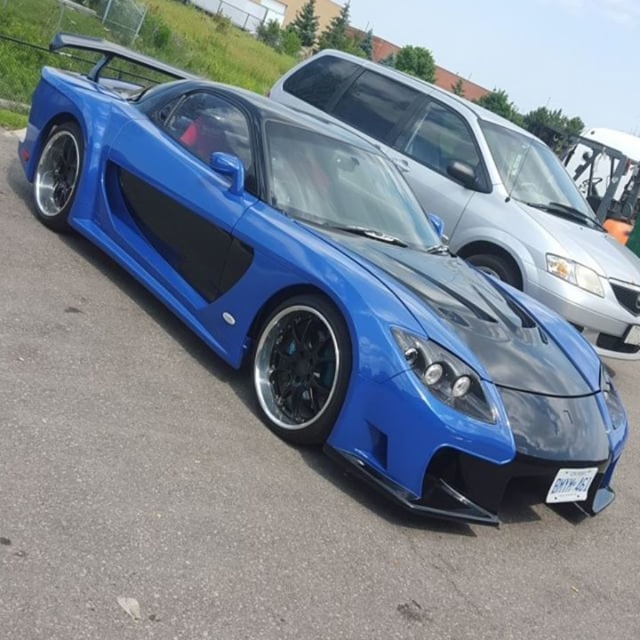
From the picture: You are a photographer wanting to capture the glossy blue sports car at center and the white plastic license plate at lower center in the same frame. Which object should you focus on first if you want to ensure both are in focus?

The glossy blue sports car at center is much taller than the white plastic license plate at lower center, so focusing on the taller object first would help ensure both are in focus.

You are standing at the origin point of the coordinate system. You want to walk to the glossy blue sports car at center. What direction should you go?

The glossy blue sports car at center is located at coordinate point (484, 189), so you should move towards the northeast direction from your current position at the origin.

You are standing at the origin point in the image. The shiny blue sports car at center is positioned at coordinates approximately 0.445 units along the x and 0.503 units along the y. If you want to walk directly towards the car, which direction should you move in terms of x and y coordinates?

To move towards the shiny blue sports car at center located at coordinates approximately 0.445 units in the x and 0.503 units in the y, you should move in the positive x and positive y directions since the car is at higher x and y coordinates compared to the origin.